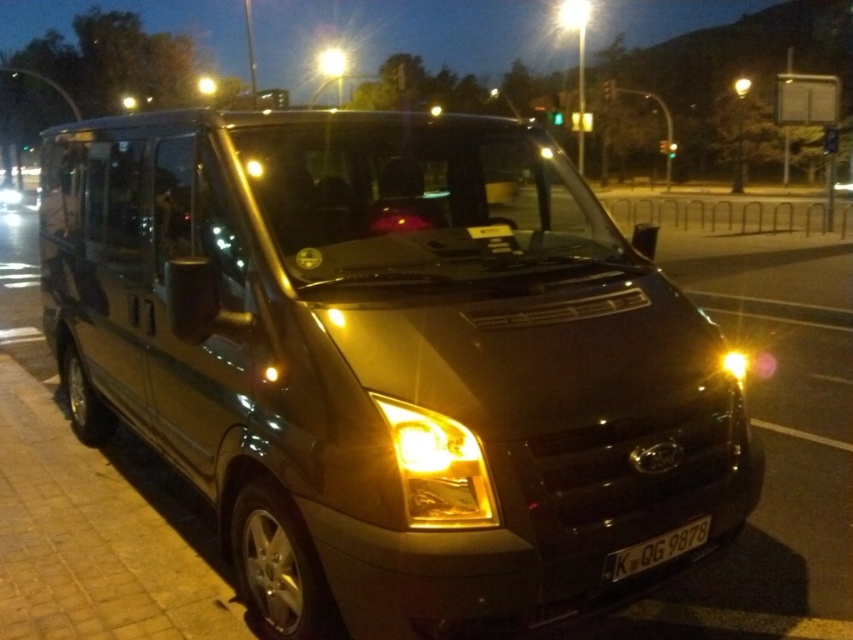
From the picture: Between metallic gold van at center and matte gold headlight at center, which one is positioned lower?

matte gold headlight at center is below.

Is metallic gold van at center wider than matte gold headlight at center?

Yes, metallic gold van at center is wider than matte gold headlight at center.

Locate an element on the screen. The width and height of the screenshot is (853, 640). metallic gold van at center is located at coordinates pos(386,356).

This screenshot has height=640, width=853. What do you see at coordinates (654, 550) in the screenshot?
I see `black plastic license plate at lower center` at bounding box center [654, 550].

Can you confirm if black plastic license plate at lower center is positioned to the left of matte gold headlight at center?

Yes, black plastic license plate at lower center is to the left of matte gold headlight at center.

Does point (677, 534) come in front of point (730, 353)?

Yes, point (677, 534) is closer to viewer.

Find the location of a particular element. The image size is (853, 640). black plastic license plate at lower center is located at coordinates (654, 550).

Is metallic gold van at center behind black plastic license plate at lower center?

No, metallic gold van at center is closer to the viewer.

Can you confirm if metallic gold van at center is taller than black plastic license plate at lower center?

Correct, metallic gold van at center is much taller as black plastic license plate at lower center.

Locate an element on the screen. metallic gold van at center is located at coordinates (386, 356).